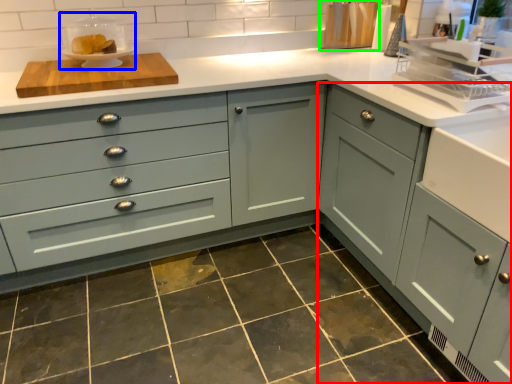
Question: Which object is the farthest from cabinetry (highlighted by a red box)? Choose among these: appliance (highlighted by a blue box) or appliance (highlighted by a green box).

Choices:
 (A) appliance
 (B) appliance

Answer: (A)